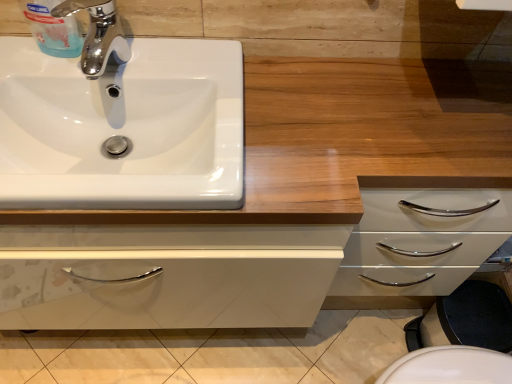
Find the location of a particular element. The image size is (512, 384). vacant space that is to the left of chrome/metallic faucet at upper left is located at coordinates (46, 72).